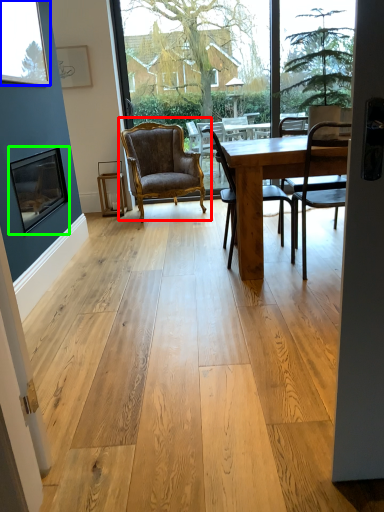
Question: Which object is the closest to the chair (highlighted by a red box)? Choose among these: window (highlighted by a blue box) or picture frame (highlighted by a green box).

Choices:
 (A) window
 (B) picture frame

Answer: (B)